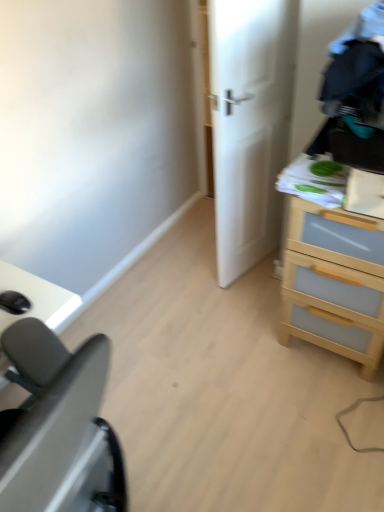
In order to click on light wood chest of drawers at right in this screenshot , I will do `click(331, 266)`.

The image size is (384, 512). What do you see at coordinates (249, 124) in the screenshot?
I see `white matte door at center` at bounding box center [249, 124].

Locate an element on the screen. The height and width of the screenshot is (512, 384). black matte desk at lower left is located at coordinates (59, 426).

Find the location of `light wood chest of drawers at right`. light wood chest of drawers at right is located at coordinates (331, 266).

From a real-world perspective, relative to light wood chest of drawers at right, is white matte door at center vertically above or below?

In terms of real-world spatial position, white matte door at center is above light wood chest of drawers at right.

From the image's perspective, which is above, white matte door at center or light wood chest of drawers at right?

white matte door at center is shown above in the image.

Locate an element on the screen. door on the left of light wood chest of drawers at right is located at coordinates (249, 124).

Is white matte door at center looking in the opposite direction of black matte desk at lower left?

No.

Considering the sizes of white matte door at center and black matte desk at lower left in the image, is white matte door at center wider or thinner than black matte desk at lower left?

white matte door at center is thinner than black matte desk at lower left.

From a real-world perspective, is white matte door at center located beneath black matte desk at lower left?

No.

Looking at this image, are white matte door at center and black matte desk at lower left making contact?

No, white matte door at center is not in contact with black matte desk at lower left.

Locate an element on the screen. The image size is (384, 512). furniture in front of the light wood chest of drawers at right is located at coordinates (59, 426).

Is black matte desk at lower left inside the boundaries of light wood chest of drawers at right, or outside?

black matte desk at lower left is spatially situated outside light wood chest of drawers at right.

Between black matte desk at lower left and light wood chest of drawers at right, which one has larger width?

Wider between the two is black matte desk at lower left.

Identify the location of door behind the black matte desk at lower left. (249, 124).

Does point (96, 412) come closer to viewer compared to point (276, 4)?

Yes.

Considering the positions of objects black matte desk at lower left and white matte door at center in the image provided, who is in front, black matte desk at lower left or white matte door at center?

black matte desk at lower left is more forward.

In the scene shown: Can you tell me how much black matte desk at lower left and white matte door at center differ in facing direction?

166 degrees separate the facing orientations of black matte desk at lower left and white matte door at center.

Is white matte door at center located within light wood chest of drawers at right?

No, light wood chest of drawers at right does not contain white matte door at center.

Locate an element on the screen. door to the left of light wood chest of drawers at right is located at coordinates (249, 124).

From the image's perspective, is light wood chest of drawers at right over white matte door at center?

Incorrect, from the image's perspective, light wood chest of drawers at right is lower than white matte door at center.

Is light wood chest of drawers at right positioned far away from white matte door at center?

That's not correct — light wood chest of drawers at right is a little close to white matte door at center.

Is light wood chest of drawers at right facing away from black matte desk at lower left?

light wood chest of drawers at right does not have its back to black matte desk at lower left.

Is point (282, 170) farther from viewer compared to point (68, 483)?

That is True.

Is light wood chest of drawers at right smaller than black matte desk at lower left?

Correct, light wood chest of drawers at right occupies less space than black matte desk at lower left.

How distant is light wood chest of drawers at right from black matte desk at lower left?

They are 37.34 inches apart.

The width and height of the screenshot is (384, 512). I want to click on chest of drawers in front of the white matte door at center, so click(331, 266).

This screenshot has height=512, width=384. I want to click on furniture that is below the white matte door at center (from the image's perspective), so click(59, 426).

Considering their positions, is light wood chest of drawers at right positioned closer to black matte desk at lower left than white matte door at center?

Based on the image, light wood chest of drawers at right appears to be nearer to black matte desk at lower left.

Considering their positions, is black matte desk at lower left positioned closer to white matte door at center than light wood chest of drawers at right?

light wood chest of drawers at right is closer to white matte door at center.

When comparing their distances from white matte door at center, does light wood chest of drawers at right or black matte desk at lower left seem closer?

light wood chest of drawers at right is closer to white matte door at center.

When comparing their distances from light wood chest of drawers at right, does black matte desk at lower left or white matte door at center seem further?

Based on the image, black matte desk at lower left appears to be further to light wood chest of drawers at right.

From the image, which object appears to be nearer to light wood chest of drawers at right, white matte door at center or black matte desk at lower left?

white matte door at center is positioned closer to the anchor light wood chest of drawers at right.

When comparing their distances from black matte desk at lower left, does white matte door at center or light wood chest of drawers at right seem further?

white matte door at center is further to black matte desk at lower left.

Identify the location of door between black matte desk at lower left and light wood chest of drawers at right from left to right. (249, 124).